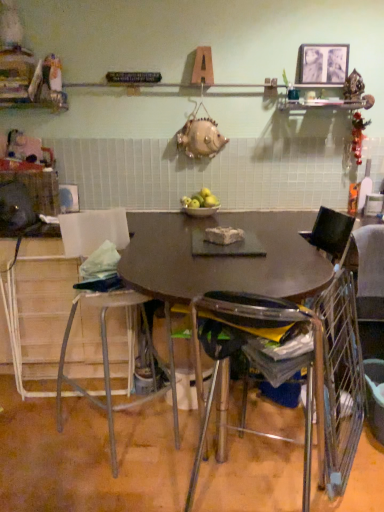
Find the location of a particular element. vacant space that is to the left of metallic stool at lower left, which is the 1th chair from left to right is located at coordinates (37, 436).